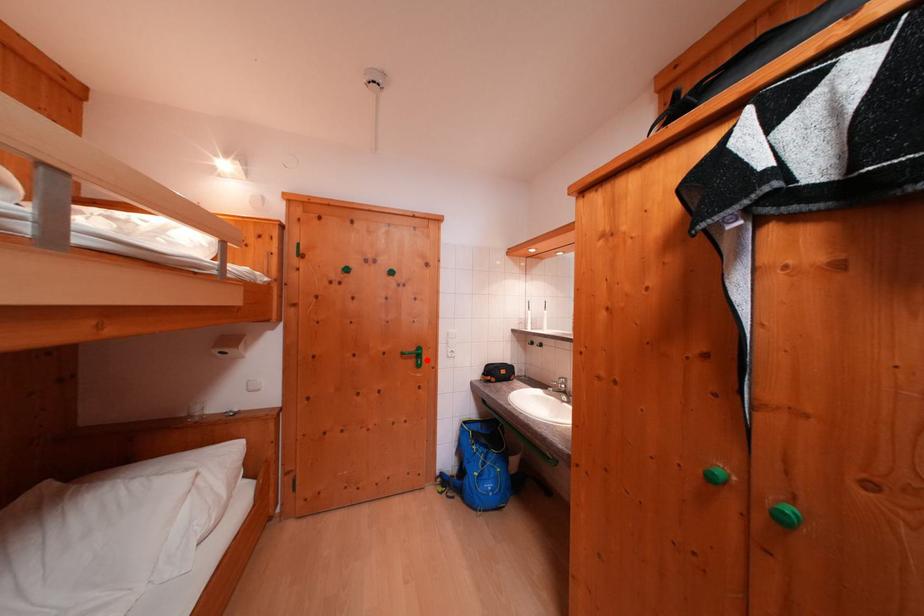
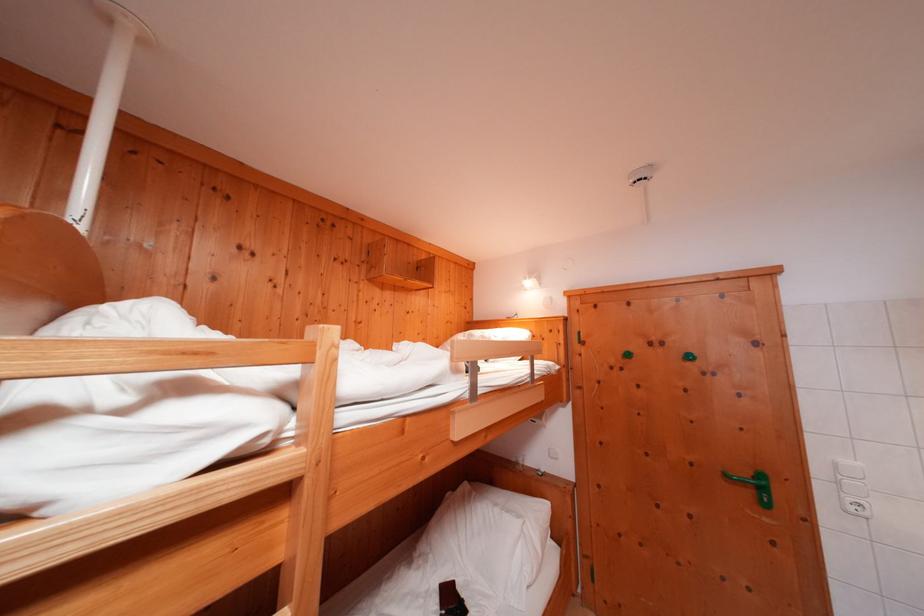
Question: A red point is marked in image1. In image2, is the corresponding 3D point closer to the camera or farther? Reply with the corresponding letter.

Choices:
 (A) The corresponding 3D point is closer.
 (B) The corresponding 3D point is farther.

Answer: (A)